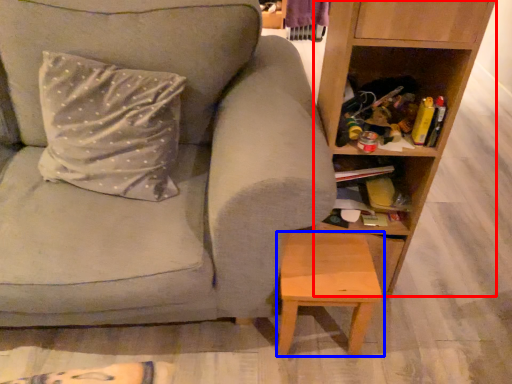
Question: Which object is further to the camera taking this photo, shelf (highlighted by a red box) or stool (highlighted by a blue box)?

Choices:
 (A) shelf
 (B) stool

Answer: (B)